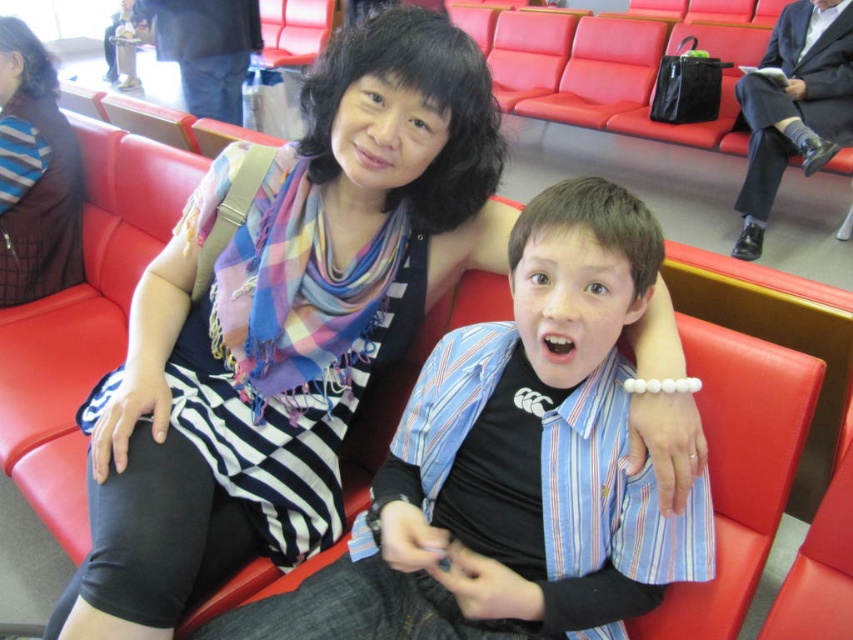
Who is positioned more to the left, striped shirt at center or striped fabric scarf at upper left?

Positioned to the left is striped fabric scarf at upper left.

Who is more distant from viewer, (364, 528) or (21, 156)?

Positioned behind is point (21, 156).

Does point (595, 257) come closer to viewer compared to point (59, 232)?

Yes, it is in front of point (59, 232).

Image resolution: width=853 pixels, height=640 pixels. I want to click on striped shirt at center, so click(x=514, y=464).